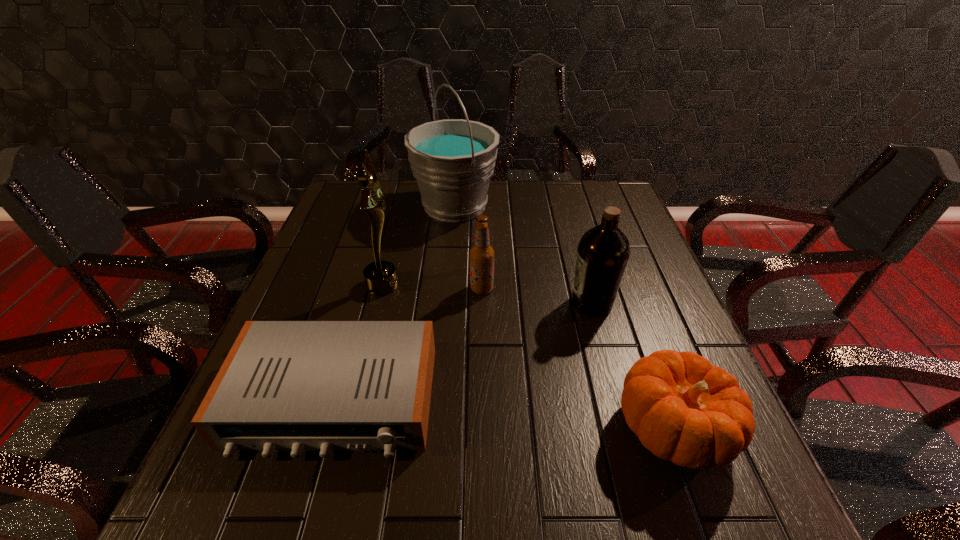
The width and height of the screenshot is (960, 540). What are the coordinates of `vacant area that lies between the second shortest object and the radio receiver` in the screenshot? It's located at (503, 414).

At what (x,y) coordinates should I click in order to perform the action: click on free space that is in between the award and the farthest object. Please return your answer as a coordinate pair (x, y). The width and height of the screenshot is (960, 540). Looking at the image, I should click on (419, 245).

Image resolution: width=960 pixels, height=540 pixels. What are the coordinates of `vacant space that is in between the pumpkin and the bucket` in the screenshot? It's located at (564, 317).

You are a GUI agent. You are given a task and a screenshot of the screen. Output one action in this format:
    pyautogui.click(x=<x>, y=<y>)
    Task: Click on the vacant space that is in between the award and the beer bottle
    The image size is (960, 540).
    Given the screenshot: What is the action you would take?
    pyautogui.click(x=432, y=286)

What are the coordinates of `empty location between the radio receiver and the bucket` in the screenshot? It's located at (395, 303).

You are a GUI agent. You are given a task and a screenshot of the screen. Output one action in this format:
    pyautogui.click(x=<x>, y=<y>)
    Task: Click on the free space between the beer bottle and the fifth tallest object
    
    Given the screenshot: What is the action you would take?
    pyautogui.click(x=577, y=359)

Where is `free space that is in between the radio receiver and the olive oil`? The image size is (960, 540). free space that is in between the radio receiver and the olive oil is located at coordinates [463, 352].

Where is `empty location between the radio receiver and the pumpkin`? The image size is (960, 540). empty location between the radio receiver and the pumpkin is located at coordinates (503, 414).

Find the location of a particular element. Image resolution: width=960 pixels, height=540 pixels. object that stands as the second closest to the second shortest object is located at coordinates (481, 254).

Identify which object is located as the nearest to the fifth tallest object. Please provide its 2D coordinates. Your answer should be formatted as a tuple, i.e. [(x, y)], where the tuple contains the x and y coordinates of a point satisfying the conditions above.

[(603, 252)]